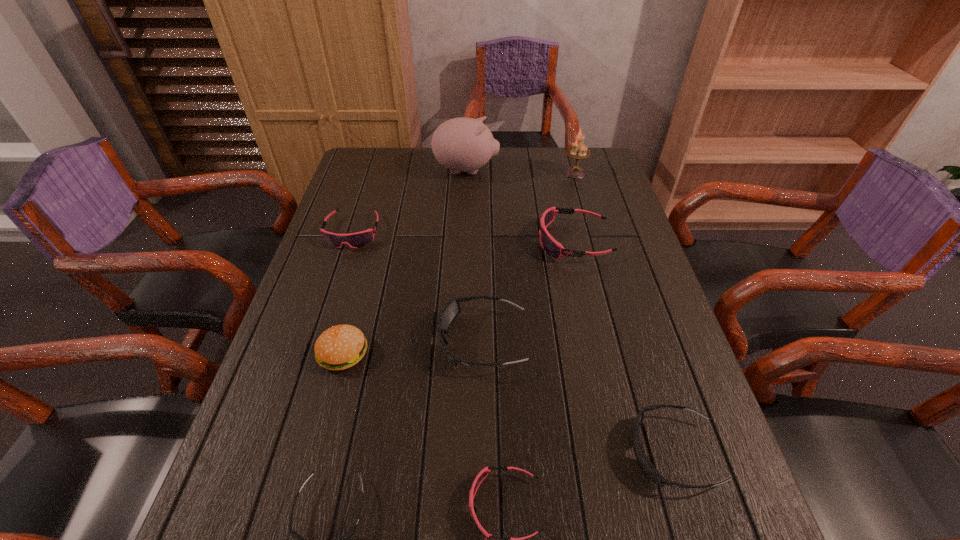
This screenshot has width=960, height=540. In order to click on vacant space at the far left corner of the desktop in this screenshot , I will do `click(352, 161)`.

Find the location of `empty location between the brown patty and the leftmost pink goggles`. empty location between the brown patty and the leftmost pink goggles is located at coordinates (348, 293).

Image resolution: width=960 pixels, height=540 pixels. In order to click on vacant area that lies between the fourth nearest goggles and the rightmost pink goggles in this screenshot , I will do point(529,291).

Find the location of a particular element. The width and height of the screenshot is (960, 540). unoccupied area between the rightmost black goggles and the farthest black goggles is located at coordinates (578, 397).

Where is `the eighth closest object to the smallest black goggles`? the eighth closest object to the smallest black goggles is located at coordinates (577, 151).

Identify which object is located as the third nearest to the second smallest pink goggles. Please provide its 2D coordinates. Your answer should be formatted as a tuple, i.e. [(x, y)], where the tuple contains the x and y coordinates of a point satisfying the conditions above.

[(449, 312)]

Select which goggles is the fourth closest to the leftmost pink goggles. Please provide its 2D coordinates. Your answer should be formatted as a tuple, i.e. [(x, y)], where the tuple contains the x and y coordinates of a point satisfying the conditions above.

[(489, 539)]

Choose which goggles is the second nearest neighbor to the second smallest black goggles. Please provide its 2D coordinates. Your answer should be formatted as a tuple, i.e. [(x, y)], where the tuple contains the x and y coordinates of a point satisfying the conditions above.

[(449, 312)]

I want to click on pink goggles that is the closest to the piggy bank, so click(355, 240).

Where is `the third closest pink goggles to the piggy bank`? the third closest pink goggles to the piggy bank is located at coordinates (489, 539).